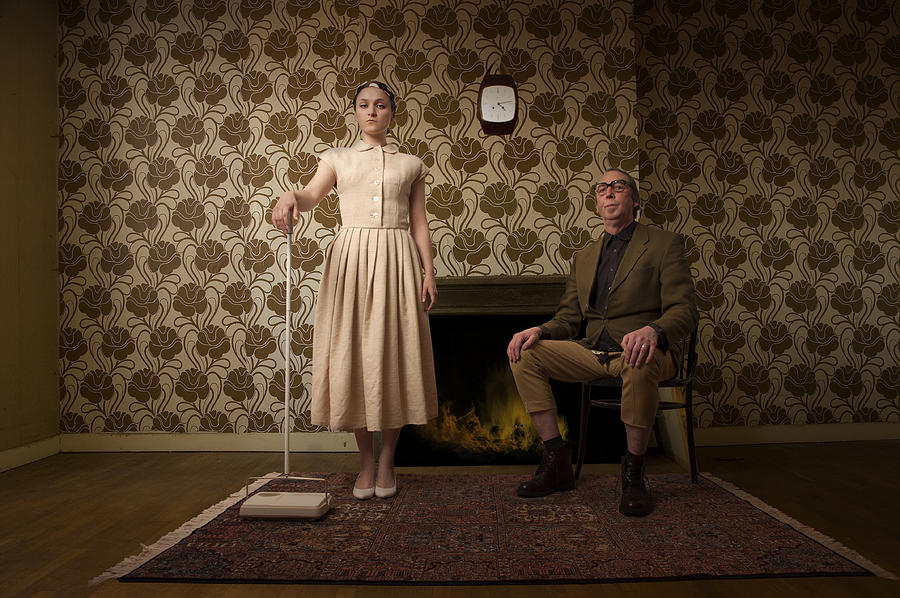
The height and width of the screenshot is (598, 900). I want to click on man sitting on a chair, so click(x=622, y=283), click(x=676, y=385).